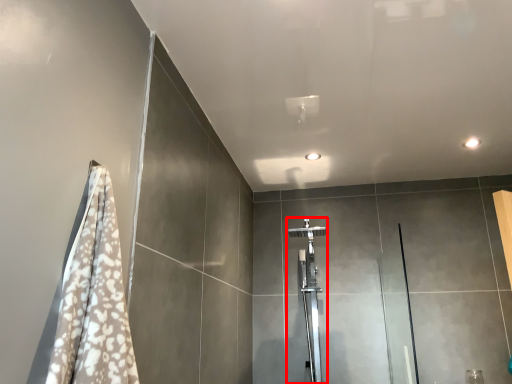
Question: Considering the relative positions of shower (annotated by the red box) and screen door in the image provided, where is shower (annotated by the red box) located with respect to the staircase?

Choices:
 (A) left
 (B) right

Answer: (A)